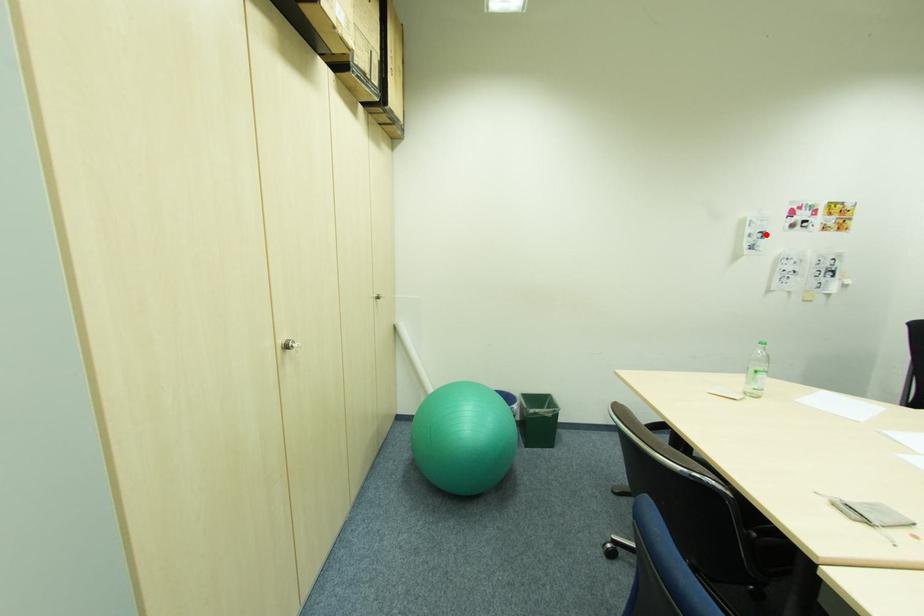
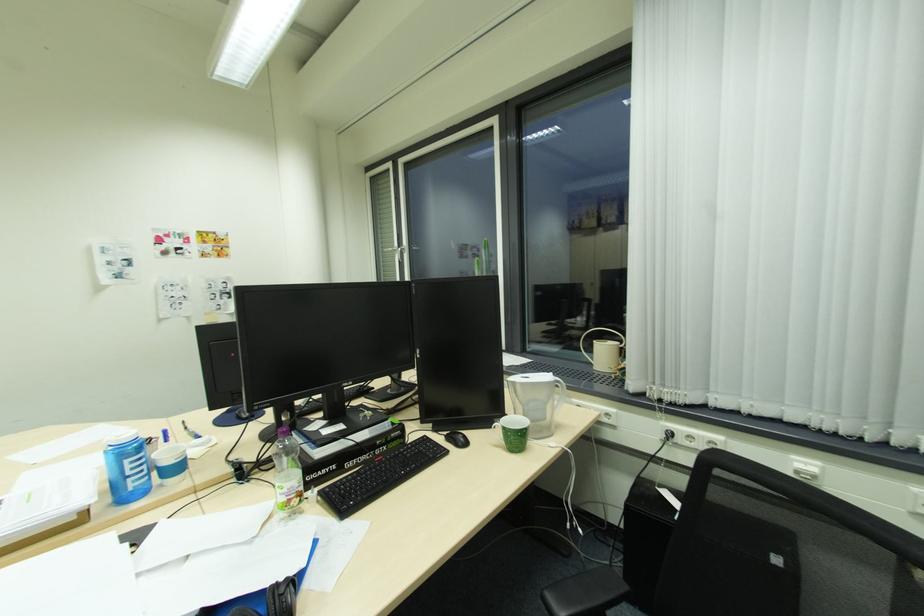
In the second image, find the point that corresponds to the highlighted location in the first image.

(131, 262)